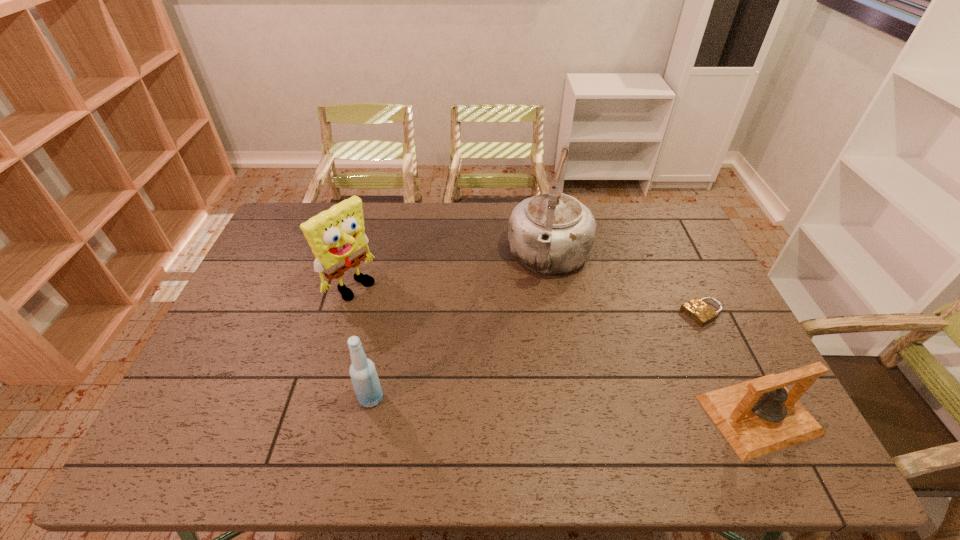
Identify the location of vacant region between the leftmost object and the tallest object. (451, 272).

Locate an element on the screen. Image resolution: width=960 pixels, height=540 pixels. vacant space that's between the fourth tallest object and the fourth shortest object is located at coordinates (555, 350).

The width and height of the screenshot is (960, 540). In order to click on blank region between the fourth tallest object and the sponge in this screenshot , I will do `click(555, 350)`.

The height and width of the screenshot is (540, 960). What are the coordinates of `unoccupied position between the second shortest object and the third object from right to left` in the screenshot? It's located at (654, 336).

Identify the location of free space between the second shortest object and the tallest object. (654, 336).

Where is `free point between the third shortest object and the padlock`? This screenshot has width=960, height=540. free point between the third shortest object and the padlock is located at coordinates (537, 355).

You are a GUI agent. You are given a task and a screenshot of the screen. Output one action in this format:
    pyautogui.click(x=<x>, y=<y>)
    Task: Click on the unoccupied area between the third object from right to left and the second object from left to right
    The image size is (960, 540).
    Given the screenshot: What is the action you would take?
    pyautogui.click(x=460, y=328)

Find the location of `vacant space that is in between the kettle and the second object from left to right`. vacant space that is in between the kettle and the second object from left to right is located at coordinates (460, 328).

At what (x,y) coordinates should I click in order to perform the action: click on vacant region between the shortest object and the bell. Please return your answer as a coordinate pair (x, y). This screenshot has width=960, height=540. Looking at the image, I should click on (731, 364).

What are the coordinates of `vacant space that is in between the leftmost object and the fourth tallest object` in the screenshot? It's located at [x=555, y=350].